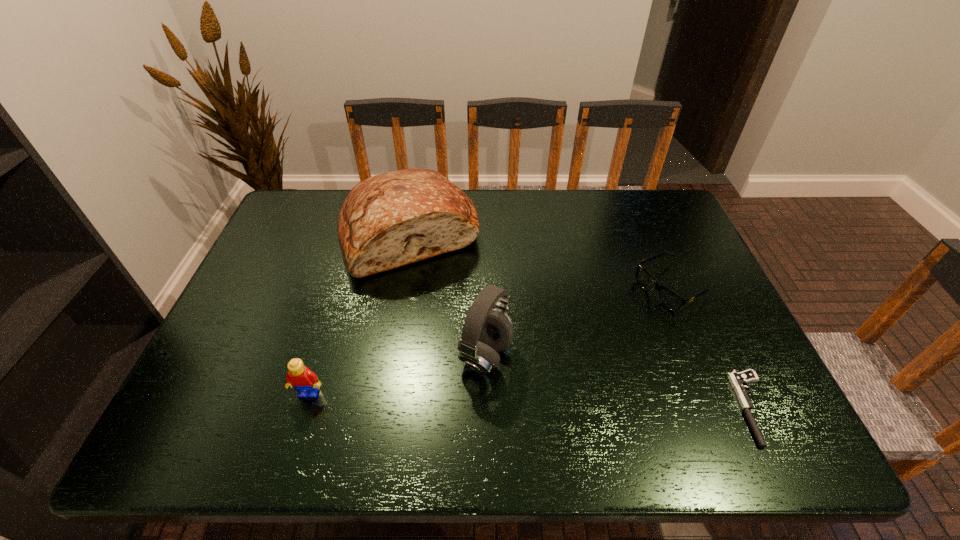
This screenshot has height=540, width=960. I want to click on object that is at the near right corner, so (738, 380).

Image resolution: width=960 pixels, height=540 pixels. I want to click on vacant area at the far edge of the desktop, so click(495, 191).

Where is `vacant space at the near edge`? Image resolution: width=960 pixels, height=540 pixels. vacant space at the near edge is located at coordinates (641, 401).

At what (x,y) coordinates should I click in order to perform the action: click on free space at the left edge of the desktop. Please return your answer as a coordinate pair (x, y). Looking at the image, I should click on (321, 245).

The height and width of the screenshot is (540, 960). I want to click on vacant space at the right edge of the desktop, so click(x=702, y=267).

Identify the location of free space at the far left corner of the desktop. The image size is (960, 540). (318, 189).

What are the coordinates of `vacant space in between the pistol and the bread` in the screenshot? It's located at (583, 321).

The width and height of the screenshot is (960, 540). Identify the location of free space that is in between the shortest object and the Lego. (532, 400).

This screenshot has width=960, height=540. Find the location of `blank region between the headset and the third shortest object`. blank region between the headset and the third shortest object is located at coordinates (397, 374).

Identify the location of vacant space in between the bread and the pistol. (583, 321).